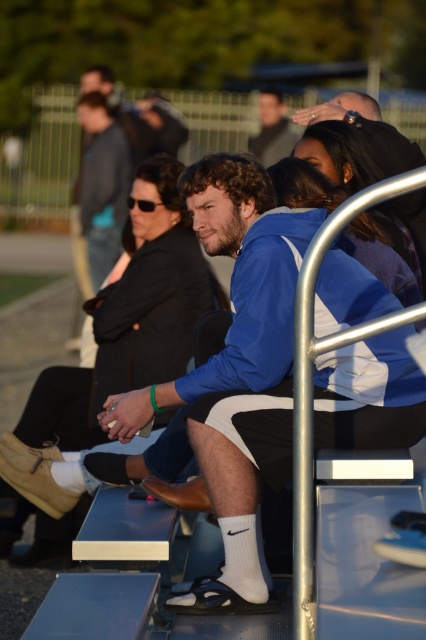
How far apart are blue fleece jacket at center and matte black jacket at center?

8.19 meters

Where is `blue fleece jacket at center`? Image resolution: width=426 pixels, height=640 pixels. blue fleece jacket at center is located at coordinates (367, 131).